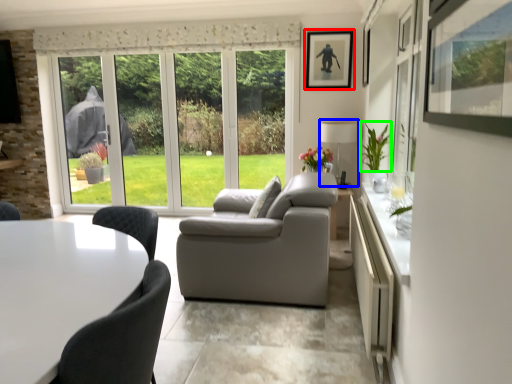
Question: Which object is positioned farthest from picture frame (highlighted by a red box)? Select from lamp (highlighted by a blue box) and plant (highlighted by a green box).

Choices:
 (A) lamp
 (B) plant

Answer: (B)